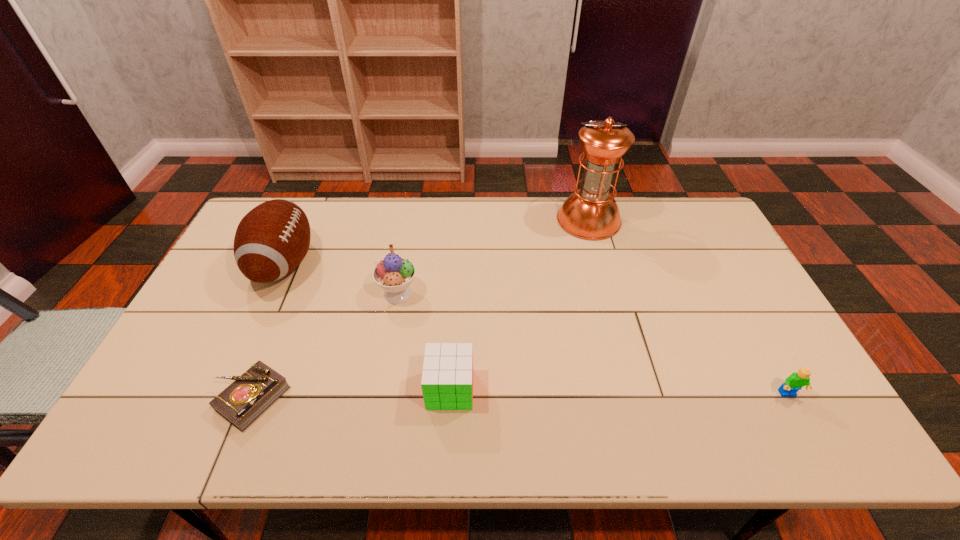
You are a GUI agent. You are given a task and a screenshot of the screen. Output one action in this format:
    pyautogui.click(x=<x>, y=<y>)
    Task: Click on the vacant point that satisfies the following two spatial constraints: 1. on the laces of the football; 2. on the back side of the third object from left to right
    This screenshot has width=960, height=540.
    Given the screenshot: What is the action you would take?
    pyautogui.click(x=271, y=293)